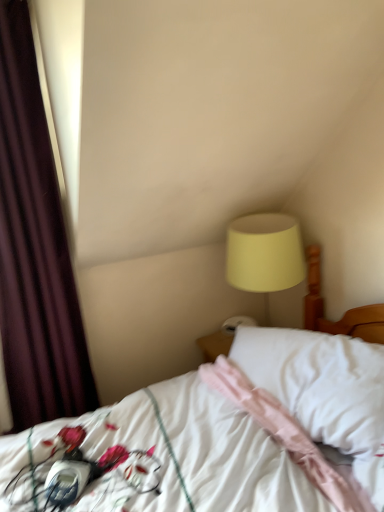
Question: From the image's perspective, does dark purple velvet curtain at left appear higher than white satin bed at center?

Choices:
 (A) yes
 (B) no

Answer: (A)

Question: Is dark purple velvet curtain at left oriented away from white satin bed at center?

Choices:
 (A) no
 (B) yes

Answer: (A)

Question: From the image's perspective, is dark purple velvet curtain at left below white satin bed at center?

Choices:
 (A) yes
 (B) no

Answer: (B)

Question: Is there a large distance between dark purple velvet curtain at left and white satin bed at center?

Choices:
 (A) no
 (B) yes

Answer: (A)

Question: Is dark purple velvet curtain at left outside white satin bed at center?

Choices:
 (A) yes
 (B) no

Answer: (A)

Question: Does dark purple velvet curtain at left appear on the right side of white satin bed at center?

Choices:
 (A) no
 (B) yes

Answer: (A)

Question: Can you confirm if pink fabric pillow at center is shorter than matte yellow lampshade at upper right?

Choices:
 (A) no
 (B) yes

Answer: (B)

Question: Can you confirm if pink fabric pillow at center is thinner than matte yellow lampshade at upper right?

Choices:
 (A) no
 (B) yes

Answer: (A)

Question: Is pink fabric pillow at center aimed at matte yellow lampshade at upper right?

Choices:
 (A) no
 (B) yes

Answer: (A)

Question: From the image's perspective, is pink fabric pillow at center below matte yellow lampshade at upper right?

Choices:
 (A) yes
 (B) no

Answer: (A)

Question: Does pink fabric pillow at center have a smaller size compared to matte yellow lampshade at upper right?

Choices:
 (A) no
 (B) yes

Answer: (B)

Question: Is pink fabric pillow at center to the right of matte yellow lampshade at upper right from the viewer's perspective?

Choices:
 (A) yes
 (B) no

Answer: (A)

Question: Can you confirm if matte yellow lampshade at upper right is wider than pink fabric pillow at center?

Choices:
 (A) yes
 (B) no

Answer: (B)